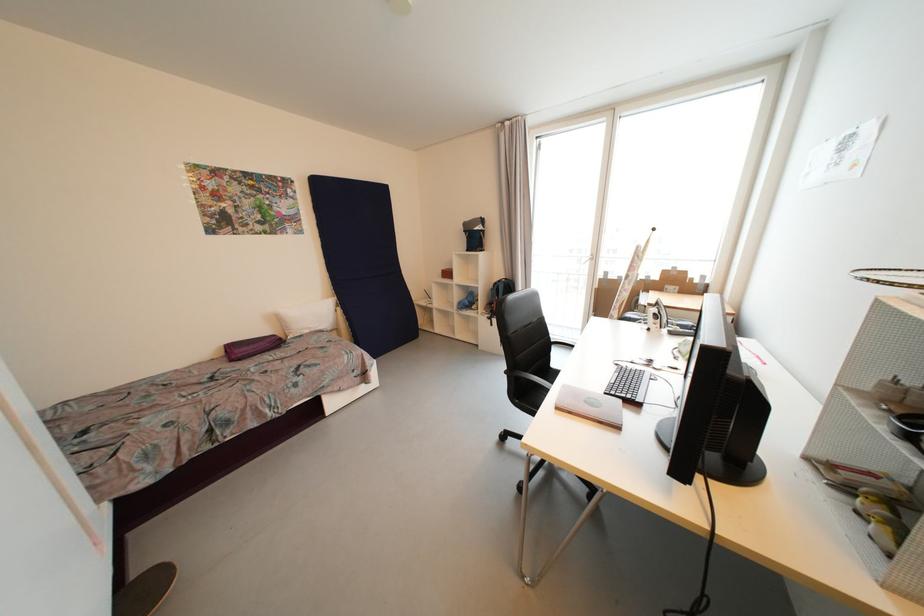
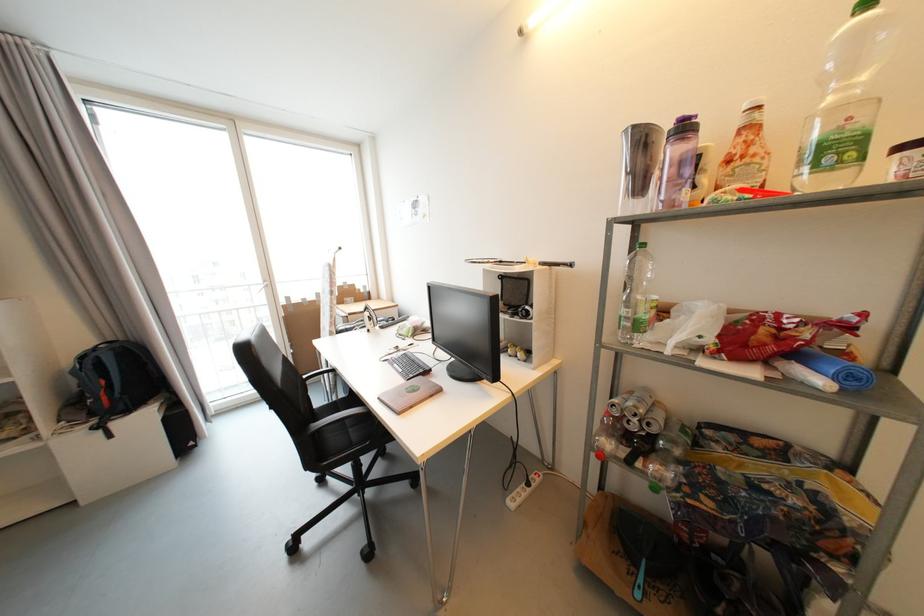
Find the pixel in the second image that matches (x=617, y=395) in the first image.

(417, 378)